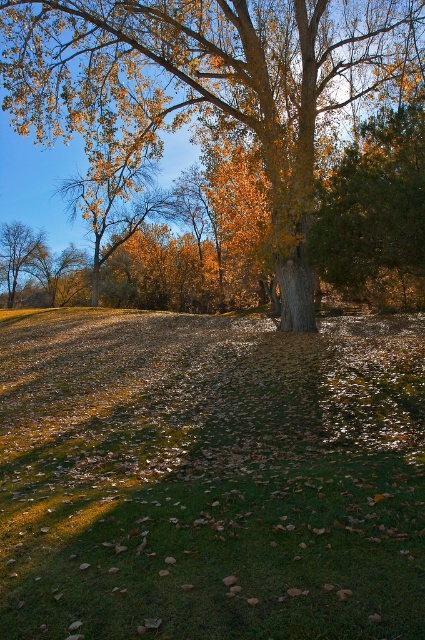
Does green grass at center appear under smooth brown tree trunk at left?

Yes, green grass at center is below smooth brown tree trunk at left.

Between point (113, 582) and point (0, 228), which one is positioned behind?

The point (0, 228) is more distant.

Describe the element at coordinates (209, 476) in the screenshot. I see `green grass at center` at that location.

You are a GUI agent. You are given a task and a screenshot of the screen. Output one action in this format:
    pyautogui.click(x=<x>, y=<y>)
    Task: Click on the green grass at center
    Image resolution: width=425 pixels, height=640 pixels.
    Given the screenshot: What is the action you would take?
    point(209,476)

Which is more to the left, golden textured tree at center or smooth brown tree trunk at left?

Positioned to the left is smooth brown tree trunk at left.

In the scene shown: Who is shorter, golden textured tree at center or smooth brown tree trunk at left?

With less height is smooth brown tree trunk at left.

The width and height of the screenshot is (425, 640). Find the location of `golden textured tree at center`. golden textured tree at center is located at coordinates (204, 83).

Find the location of `golden textured tree at center`. golden textured tree at center is located at coordinates (204, 83).

Which is more to the right, green grass at center or golden textured tree at center?

green grass at center is more to the right.

Is green grass at center taller than golden textured tree at center?

No, green grass at center is not taller than golden textured tree at center.

You are a GUI agent. You are given a task and a screenshot of the screen. Output one action in this format:
    pyautogui.click(x=<x>, y=<y>)
    Task: Click on the green grass at center
    
    Given the screenshot: What is the action you would take?
    pyautogui.click(x=209, y=476)

Identify the location of green grass at center. (209, 476).